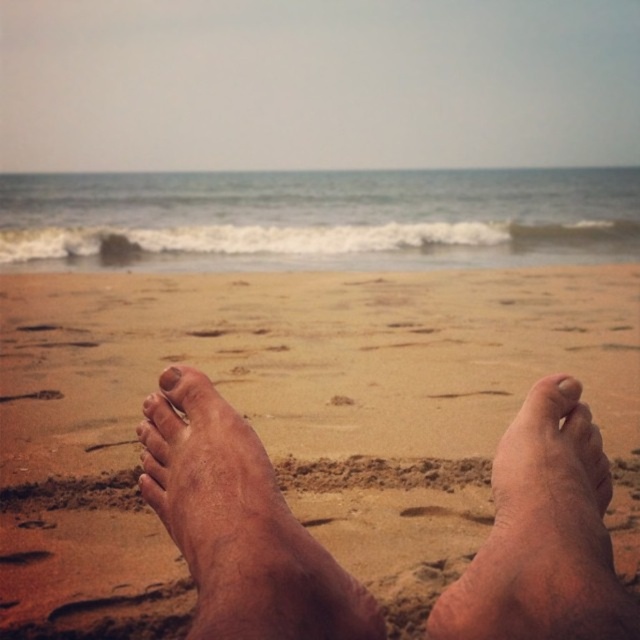
Question: Which object appears farthest from the camera in this image?

Choices:
 (A) brown rough skin at center
 (B) smooth pinkish toe at center
 (C) pink matte toe at center

Answer: (C)

Question: Which of the following is the farthest from the observer?

Choices:
 (A) smooth pinkish toe at center
 (B) dry skin foot at center

Answer: (A)

Question: Is the position of brown rough skin at center less distant than that of dry skin foot at center?

Choices:
 (A) yes
 (B) no

Answer: (B)

Question: Can you confirm if brown rough skin at center is thinner than dry skin foot at center?

Choices:
 (A) no
 (B) yes

Answer: (A)

Question: Is brown rough skin at center thinner than smooth pinkish toe at center?

Choices:
 (A) yes
 (B) no

Answer: (B)

Question: Which point is closer to the camera?

Choices:
 (A) brown rough skin at center
 (B) pink matte toe at center

Answer: (A)